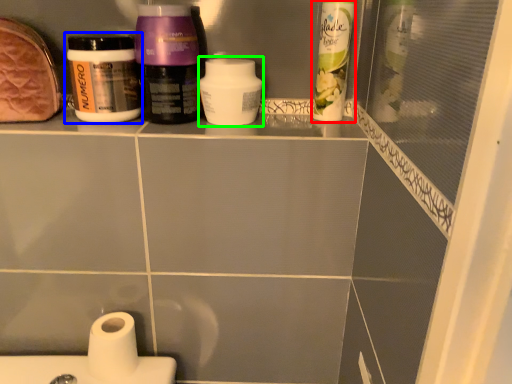
Question: Based on their relative distances, which object is nearer to cleaning product (highlighted by a red box)? Choose from bottle (highlighted by a blue box) and cleaning product (highlighted by a green box).

Choices:
 (A) bottle
 (B) cleaning product

Answer: (B)